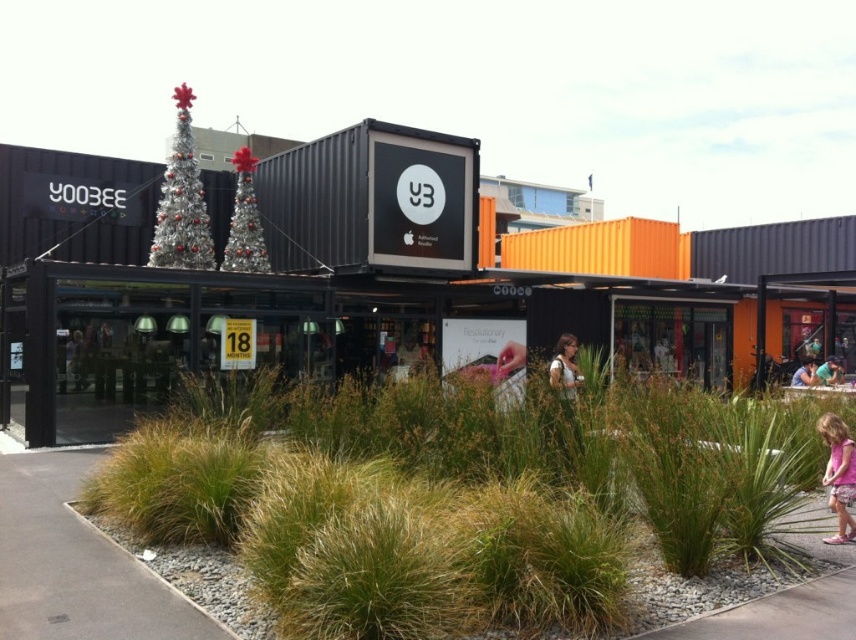
Question: Which point is closer to the camera taking this photo?

Choices:
 (A) (147, 305)
 (B) (563, 337)
 (C) (483, 397)
 (D) (21, 452)

Answer: (C)

Question: Is black matte shipping container at center above pink fabric dress at center?

Choices:
 (A) yes
 (B) no

Answer: (A)

Question: Which point is closer to the camera?

Choices:
 (A) pink fabric dress at center
 (B) pink fabric dress at lower right

Answer: (B)

Question: Can you confirm if green grass at center is thinner than pink fabric dress at lower right?

Choices:
 (A) no
 (B) yes

Answer: (A)

Question: Can you confirm if gray concrete pavement at lower left is thinner than pink fabric dress at lower right?

Choices:
 (A) yes
 (B) no

Answer: (B)

Question: Which of the following is the farthest from the observer?

Choices:
 (A) (152, 580)
 (B) (474, 486)
 (C) (572, 337)
 (D) (34, 321)

Answer: (C)